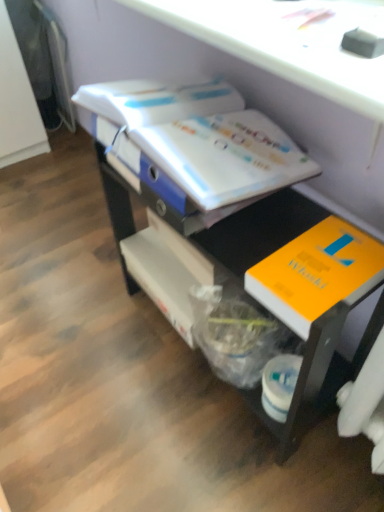
You are a GUI agent. You are given a task and a screenshot of the screen. Output one action in this format:
    pyautogui.click(x=<x>, y=<y>)
    Task: Click on the free space in front of matte black drawer at center
    The image size is (384, 512).
    Given the screenshot: What is the action you would take?
    pyautogui.click(x=216, y=461)